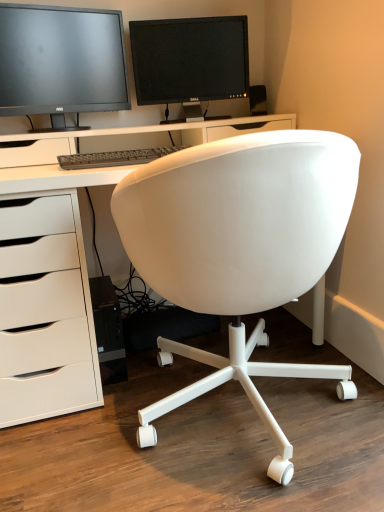
Question: Based on their sizes in the image, would you say matte black monitor at upper left, the first computer monitor viewed from the left, is bigger or smaller than white matte desk at center?

Choices:
 (A) big
 (B) small

Answer: (B)

Question: Looking at their shapes, would you say matte black monitor at upper left, the first computer monitor viewed from the left, is wider or thinner than white matte desk at center?

Choices:
 (A) thin
 (B) wide

Answer: (A)

Question: Estimate the real-world distances between objects in this image. Which object is closer to the white matte office chair at center?

Choices:
 (A) white matte desk at center
 (B) gray matte keyboard at center
 (C) matte black speaker at upper right
 (D) matte black monitor at upper left, arranged as the 2th computer monitor when viewed from the right
 (E) matte black monitor at upper center, the 2th computer monitor positioned from the left

Answer: (A)

Question: Which is nearer to the matte black monitor at upper center, which is the first computer monitor from right to left?

Choices:
 (A) white matte office chair at center
 (B) white matte desk at center
 (C) matte black speaker at upper right
 (D) matte black monitor at upper left, arranged as the 2th computer monitor when viewed from the right
 (E) gray matte keyboard at center

Answer: (D)